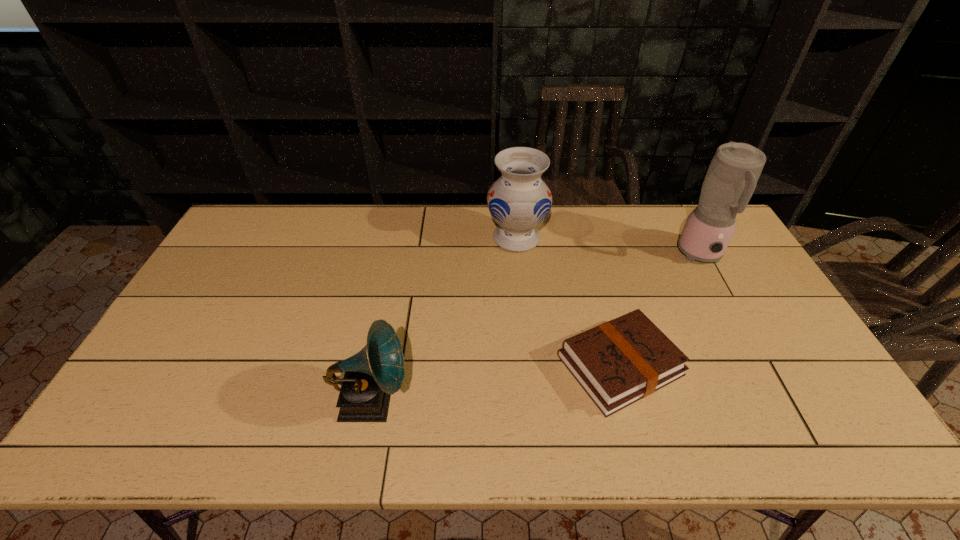
The image size is (960, 540). Identify the location of free location at the far left corner. (269, 206).

Find the location of a particular element. This screenshot has height=540, width=960. vacant area between the hardback book and the leftmost object is located at coordinates (495, 383).

Locate an element on the screen. The height and width of the screenshot is (540, 960). free spot between the vase and the shortest object is located at coordinates (568, 302).

Identify the location of free spot between the vase and the hardback book. This screenshot has height=540, width=960. (568, 302).

Identify the location of blank region between the shortest object and the leftmost object. This screenshot has width=960, height=540. (495, 383).

I want to click on vacant space in between the vase and the shortest object, so click(x=568, y=302).

Identify the location of free space between the tallest object and the third tallest object. This screenshot has width=960, height=540. (536, 328).

I want to click on vacant area that lies between the vase and the third tallest object, so click(x=444, y=319).

Where is `free space between the hardback book and the vase`? This screenshot has width=960, height=540. free space between the hardback book and the vase is located at coordinates (568, 302).

I want to click on vacant space in between the hardback book and the tallest object, so click(x=660, y=310).